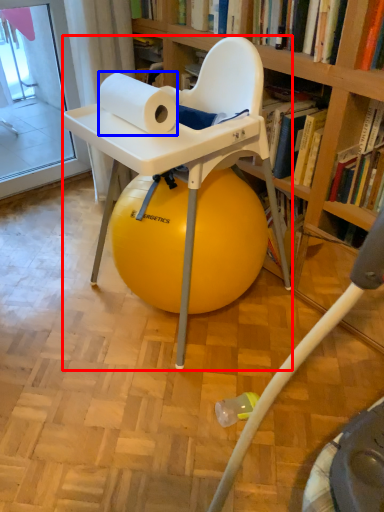
Question: Which object appears farthest to the camera in this image, chair (highlighted by a red box) or paper towel (highlighted by a blue box)?

Choices:
 (A) chair
 (B) paper towel

Answer: (A)